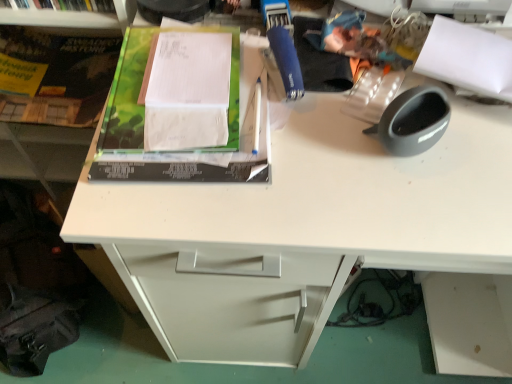
Locate an element on the screen. The height and width of the screenshot is (384, 512). unoccupied region to the right of green matte paper at upper left, the second paperback book when ordered from left to right is located at coordinates (347, 157).